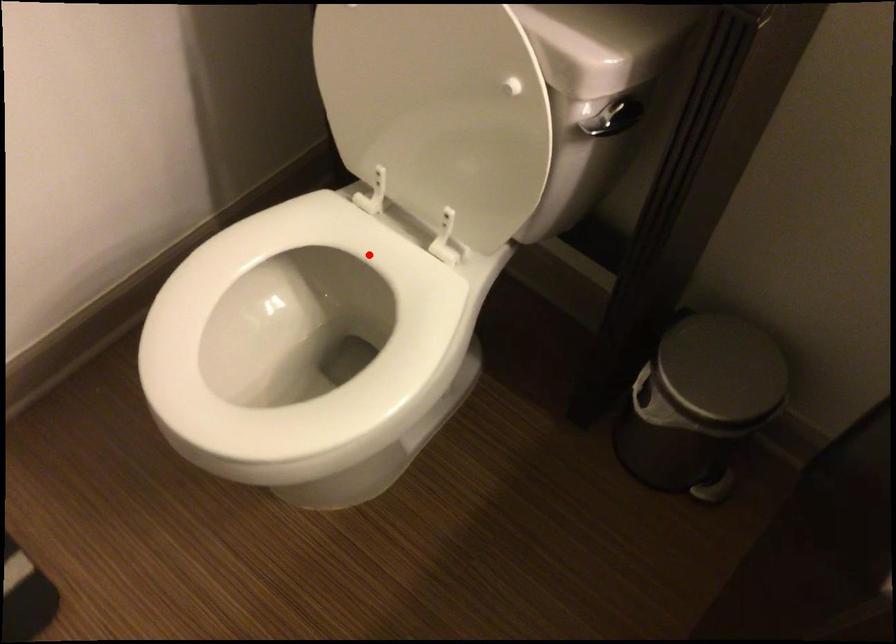
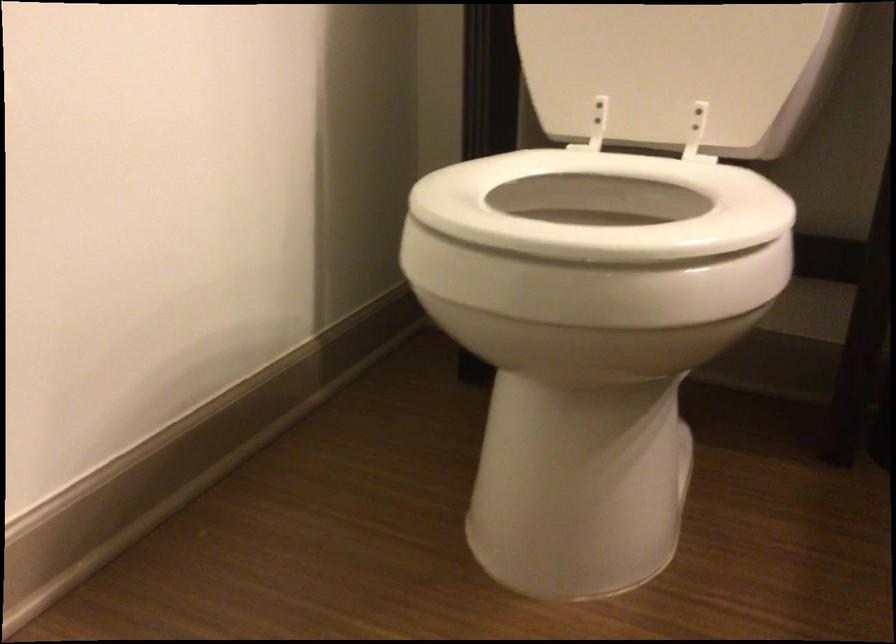
Question: I am providing you with two images of the same scene from different viewpoints. A red point is shown in image1. For the corresponding object point in image2, is it positioned nearer or farther from the camera?

Choices:
 (A) Nearer
 (B) Farther

Answer: (A)